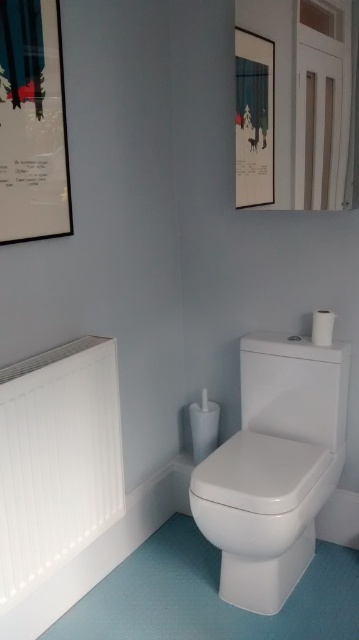
You are standing in the bathroom and see the point marked at coordinates (273, 467). Based on the scene description, can you identify which object this point is located on?

The point at coordinates (273, 467) is located on the white glossy toilet at lower right.

Based on the photo, you are designing a bathroom layout and need to place a new plant pot between the white matte radiator at left and the metallic silver picture frame at upper left. Given their sizes, which object should the plant pot be closer to?

The white matte radiator at left is bigger than the metallic silver picture frame at upper left, so the plant pot should be placed closer to the metallic silver picture frame at upper left to balance the space.

You are a plumber inspecting a bathroom. You notice the white glossy toilet at lower right and the white glossy toilet lid at center. Which object is located below the other?

The white glossy toilet at lower right is positioned under the white glossy toilet lid at center.